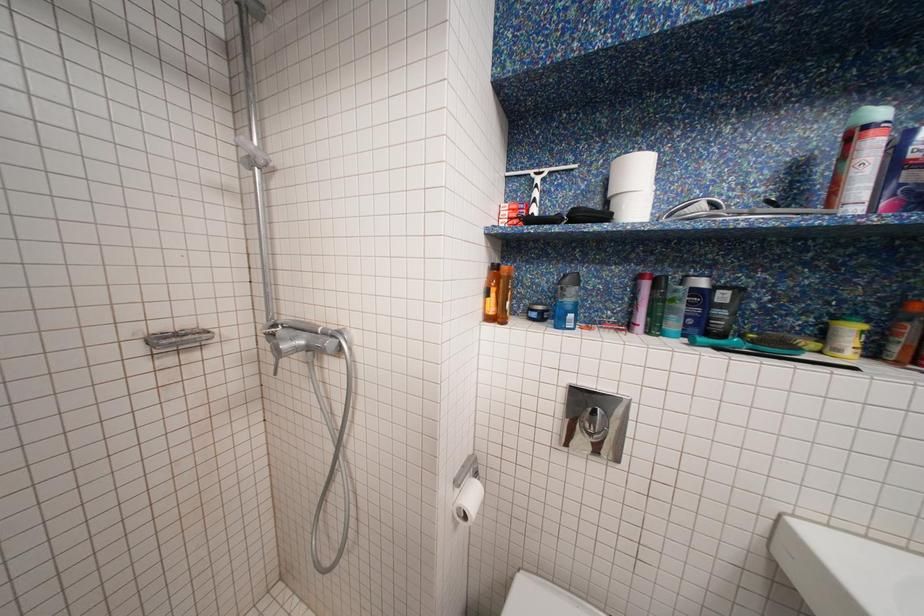
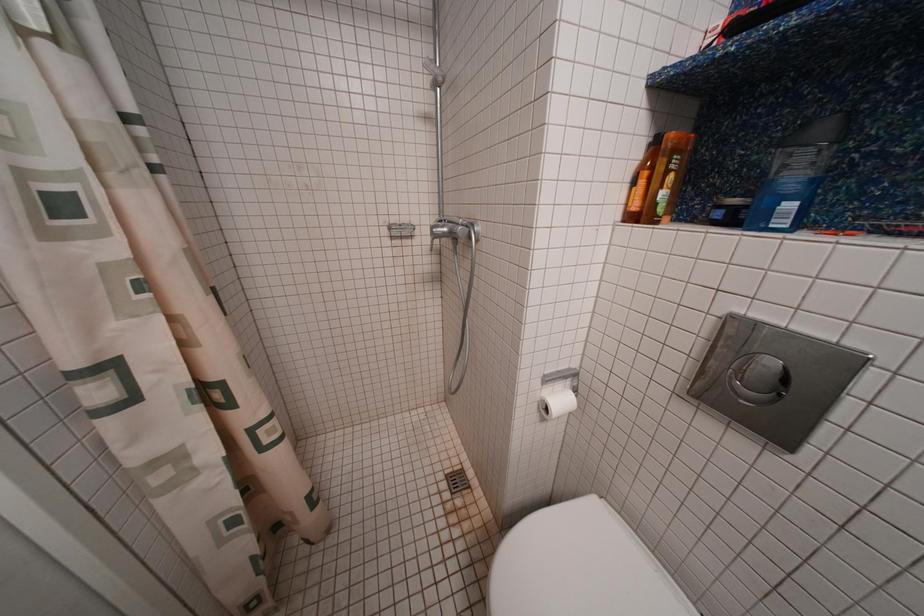
Question: Based on the continuous images, in which direction is the camera rotating? Reply with the corresponding letter.

Choices:
 (A) Left
 (B) Right
 (C) Up
 (D) Down

Answer: (A)